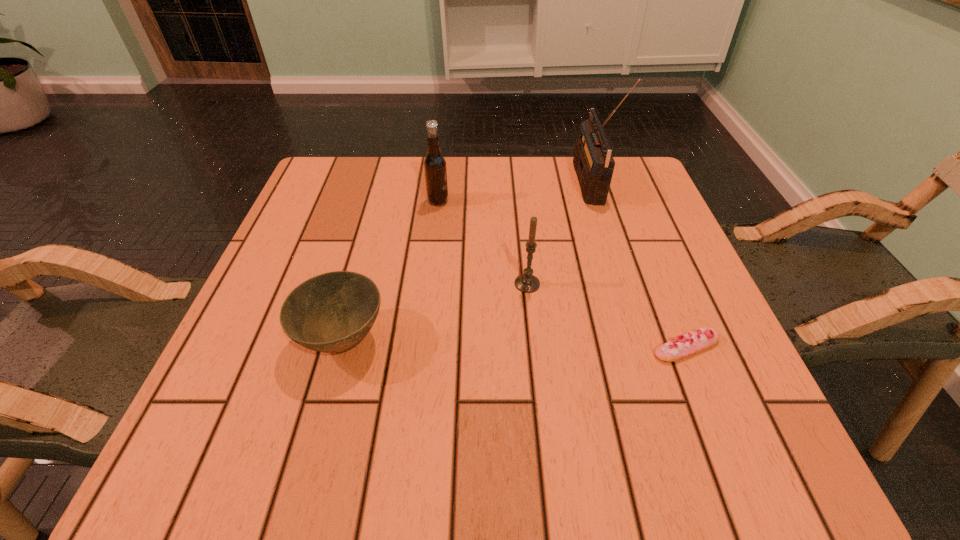
The width and height of the screenshot is (960, 540). In order to click on free space between the fourth shortest object and the second shortest object in this screenshot , I will do pyautogui.click(x=391, y=271).

At what (x,y) coordinates should I click in order to perform the action: click on vacant space in between the shortest object and the bowl. Please return your answer as a coordinate pair (x, y). This screenshot has width=960, height=540. Looking at the image, I should click on (515, 343).

You are a GUI agent. You are given a task and a screenshot of the screen. Output one action in this format:
    pyautogui.click(x=<x>, y=<y>)
    Task: Click on the vacant region between the second shortest object and the third farthest object
    The height and width of the screenshot is (540, 960).
    Given the screenshot: What is the action you would take?
    pyautogui.click(x=435, y=312)

Identify the location of free space between the radio receiver and the eclair. (637, 265).

The image size is (960, 540). Find the location of `blank region between the third object from right to left and the fourth shortest object`. blank region between the third object from right to left and the fourth shortest object is located at coordinates (483, 242).

You are a GUI agent. You are given a task and a screenshot of the screen. Output one action in this format:
    pyautogui.click(x=<x>, y=<y>)
    Task: Click on the free space between the bowl and the fourth object from right to left
    This screenshot has width=960, height=540.
    Given the screenshot: What is the action you would take?
    pos(391,271)

Where is `free spot between the root beer and the third shortest object`? The width and height of the screenshot is (960, 540). free spot between the root beer and the third shortest object is located at coordinates (483, 242).

Locate which object ranks in proximity to the third object from right to left. Please provide its 2D coordinates. Your answer should be formatted as a tuple, i.e. [(x, y)], where the tuple contains the x and y coordinates of a point satisfying the conditions above.

[(678, 348)]

This screenshot has width=960, height=540. I want to click on the fourth closest object to the third object from left to right, so click(435, 170).

The height and width of the screenshot is (540, 960). I want to click on free point that satisfies the following two spatial constraints: 1. on the front-facing side of the tallest object; 2. on the left side of the eclair, so click(639, 347).